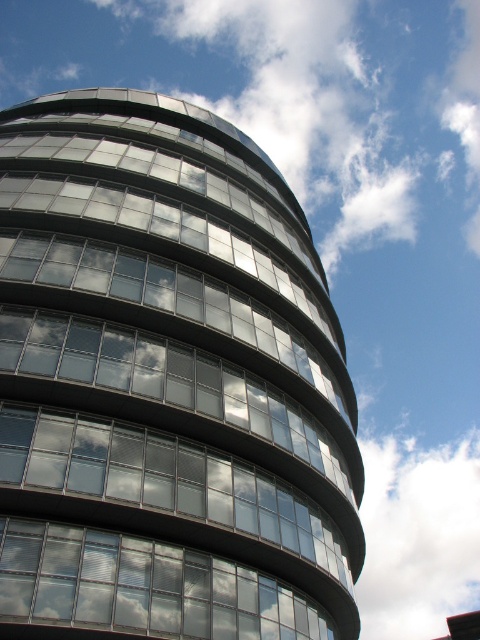
Is transparent glass windows at center bigger than white fluffy cloud at upper right?

Actually, transparent glass windows at center might be smaller than white fluffy cloud at upper right.

Is transparent glass windows at center smaller than white fluffy cloud at upper right?

Yes.

Is point (143, 572) positioned after point (467, 458)?

No, it is not.

Find the location of a particular element. The width and height of the screenshot is (480, 640). transparent glass windows at center is located at coordinates (143, 588).

Does transparent glass building at center have a lesser height compared to transparent glass windows at center?

No, transparent glass building at center is not shorter than transparent glass windows at center.

Who is lower down, transparent glass building at center or transparent glass windows at center?

transparent glass windows at center

Describe the element at coordinates (167, 384) in the screenshot. I see `transparent glass building at center` at that location.

Image resolution: width=480 pixels, height=640 pixels. Find the location of `transparent glass building at center`. transparent glass building at center is located at coordinates (167, 384).

From the picture: Is transparent glass building at center positioned before white fluffy cloud at upper right?

Yes, transparent glass building at center is closer to the viewer.

Looking at this image, does transparent glass building at center have a lesser height compared to white fluffy cloud at upper right?

Yes.

What do you see at coordinates (167, 384) in the screenshot? I see `transparent glass building at center` at bounding box center [167, 384].

You are a GUI agent. You are given a task and a screenshot of the screen. Output one action in this format:
    pyautogui.click(x=<x>, y=<y>)
    Task: Click on the transparent glass building at center
    This screenshot has width=480, height=640.
    Given the screenshot: What is the action you would take?
    pyautogui.click(x=167, y=384)